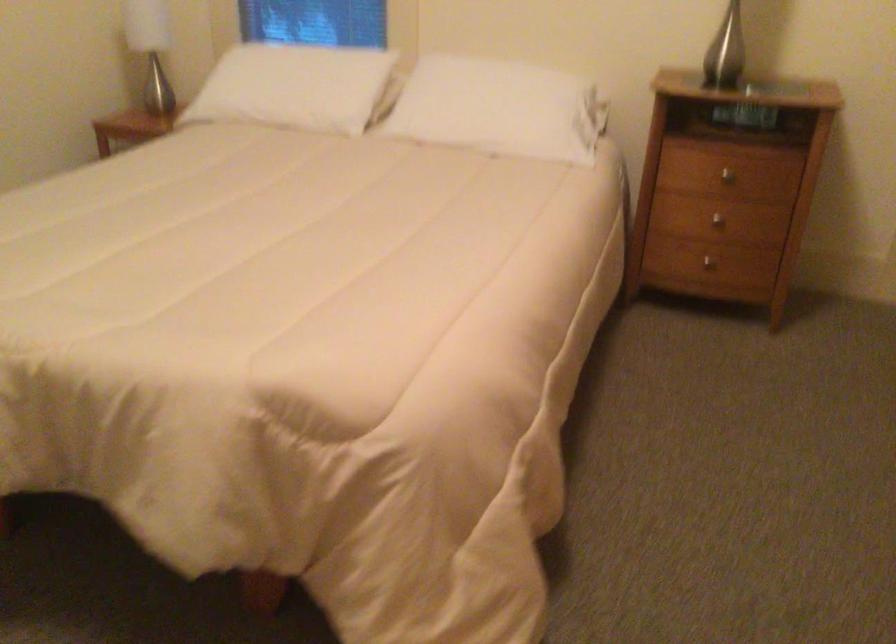
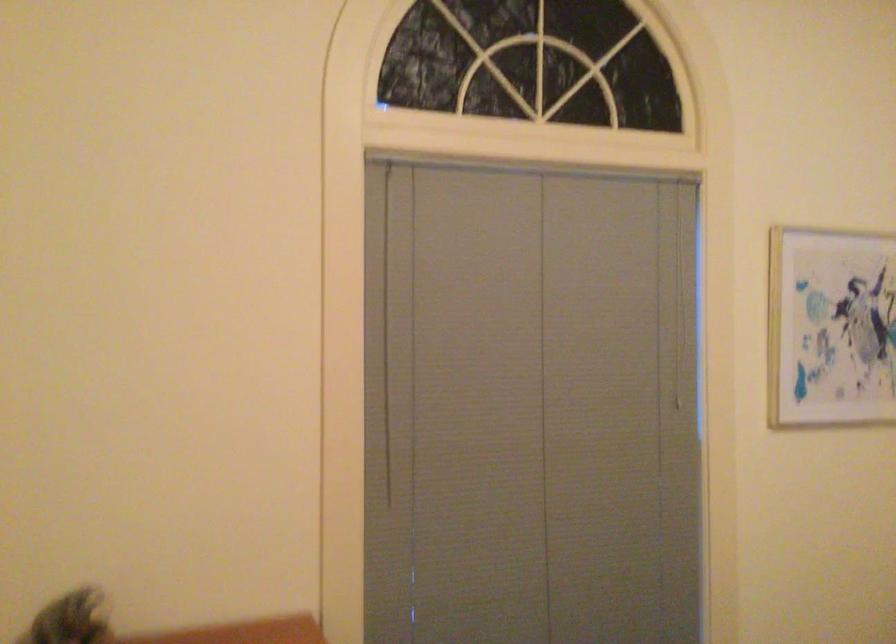
The first image is from the beginning of the video and the second image is from the end. How did the camera likely rotate when shooting the video?

The camera rotated toward left-up.